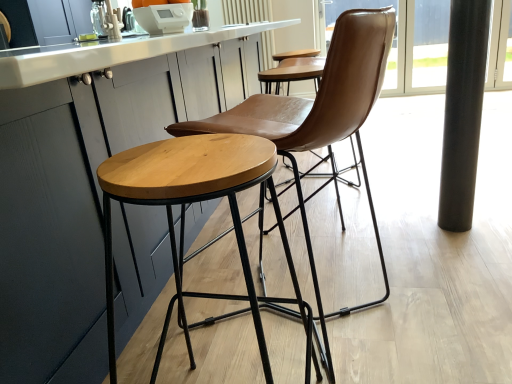
Question: From a real-world perspective, is brown leather chair at center located higher than white glossy countertop at center?

Choices:
 (A) no
 (B) yes

Answer: (A)

Question: Would you say white glossy countertop at center is part of brown leather chair at center's contents?

Choices:
 (A) no
 (B) yes

Answer: (A)

Question: Is brown leather chair at center bigger than white glossy countertop at center?

Choices:
 (A) yes
 (B) no

Answer: (B)

Question: Is brown leather chair at center looking in the opposite direction of white glossy countertop at center?

Choices:
 (A) yes
 (B) no

Answer: (B)

Question: Considering the relative sizes of brown leather chair at center and white glossy countertop at center in the image provided, is brown leather chair at center smaller than white glossy countertop at center?

Choices:
 (A) no
 (B) yes

Answer: (B)

Question: Would you say black glass window screen at right is to the left or to the right of black polished pole at right in the picture?

Choices:
 (A) right
 (B) left

Answer: (A)

Question: Is black glass window screen at right taller or shorter than black polished pole at right?

Choices:
 (A) short
 (B) tall

Answer: (B)

Question: In the image, is black glass window screen at right positioned in front of or behind black polished pole at right?

Choices:
 (A) front
 (B) behind

Answer: (B)

Question: Is black glass window screen at right bigger or smaller than black polished pole at right?

Choices:
 (A) big
 (B) small

Answer: (A)

Question: From the image's perspective, is brown leather chair at center located above or below black polished pole at right?

Choices:
 (A) above
 (B) below

Answer: (B)

Question: Is point (342, 110) closer or farther from the camera than point (471, 152)?

Choices:
 (A) closer
 (B) farther

Answer: (A)

Question: Is brown leather chair at center taller or shorter than black polished pole at right?

Choices:
 (A) tall
 (B) short

Answer: (B)

Question: Relative to black polished pole at right, is brown leather chair at center in front or behind?

Choices:
 (A) front
 (B) behind

Answer: (A)

Question: Considering the relative positions of black polished pole at right and brown leather chair at center in the image provided, is black polished pole at right to the left or to the right of brown leather chair at center?

Choices:
 (A) right
 (B) left

Answer: (A)

Question: From the image's perspective, is black polished pole at right located above or below brown leather chair at center?

Choices:
 (A) above
 (B) below

Answer: (A)